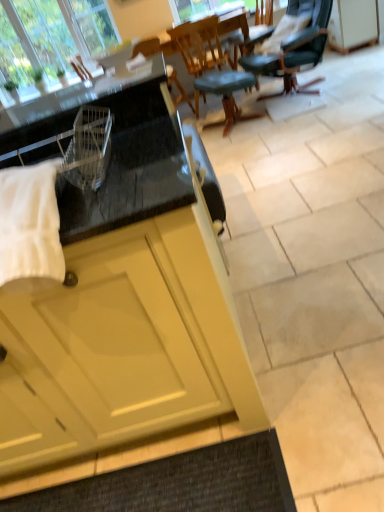
Question: Is wooden chair at center, which appears as the second chair when viewed from the right, looking in the opposite direction of matte yellow cabinet at upper right, the second cabinetry ordered from the bottom?

Choices:
 (A) yes
 (B) no

Answer: (B)

Question: From a real-world perspective, does wooden chair at center, which appears as the second chair when viewed from the right, sit lower than matte yellow cabinet at upper right, the second cabinetry ordered from the bottom?

Choices:
 (A) yes
 (B) no

Answer: (B)

Question: From the image's perspective, is wooden chair at center, which appears as the first chair when viewed from the left, below matte yellow cabinet at upper right, the second cabinetry ordered from the bottom?

Choices:
 (A) yes
 (B) no

Answer: (A)

Question: Is wooden chair at center, which appears as the second chair when viewed from the right, closer to the viewer compared to matte yellow cabinet at upper right, the second cabinetry ordered from the bottom?

Choices:
 (A) no
 (B) yes

Answer: (B)

Question: Can you confirm if wooden chair at center, which appears as the first chair when viewed from the left, is thinner than matte yellow cabinet at upper right, arranged as the second cabinetry when viewed from the left?

Choices:
 (A) yes
 (B) no

Answer: (B)

Question: In terms of size, does wooden chair at center, which appears as the first chair when viewed from the left, appear bigger or smaller than green leather office chair at upper right, the second chair when ordered from left to right?

Choices:
 (A) small
 (B) big

Answer: (A)

Question: From the image's perspective, is wooden chair at center, which appears as the second chair when viewed from the right, above or below green leather office chair at upper right, the second chair when ordered from left to right?

Choices:
 (A) below
 (B) above

Answer: (A)

Question: From a real-world perspective, relative to green leather office chair at upper right, the second chair when ordered from left to right, is wooden chair at center, which appears as the first chair when viewed from the left, vertically above or below?

Choices:
 (A) below
 (B) above

Answer: (A)

Question: Do you think wooden chair at center, which appears as the second chair when viewed from the right, is within green leather office chair at upper right, positioned as the first chair in right-to-left order, or outside of it?

Choices:
 (A) outside
 (B) inside

Answer: (A)

Question: Considering the positions of point (314, 33) and point (105, 256), is point (314, 33) closer or farther from the camera than point (105, 256)?

Choices:
 (A) closer
 (B) farther

Answer: (B)

Question: In the image, is green leather office chair at upper right, positioned as the first chair in right-to-left order, positioned in front of or behind matte yellow cabinet at lower left, the first cabinetry when ordered from left to right?

Choices:
 (A) behind
 (B) front

Answer: (A)

Question: Considering the positions of green leather office chair at upper right, the second chair when ordered from left to right, and matte yellow cabinet at lower left, marked as the second cabinetry in a right-to-left arrangement, in the image, is green leather office chair at upper right, the second chair when ordered from left to right, wider or thinner than matte yellow cabinet at lower left, marked as the second cabinetry in a right-to-left arrangement,?

Choices:
 (A) wide
 (B) thin

Answer: (B)

Question: Visually, is green leather office chair at upper right, the second chair when ordered from left to right, positioned to the left or to the right of matte yellow cabinet at lower left, the first cabinetry when ordered from left to right?

Choices:
 (A) left
 (B) right

Answer: (B)

Question: From a real-world perspective, is teal leather stool at center positioned above or below green leather office chair at upper right, the second chair when ordered from left to right?

Choices:
 (A) above
 (B) below

Answer: (B)

Question: Is point (256, 114) positioned closer to the camera than point (258, 57)?

Choices:
 (A) farther
 (B) closer

Answer: (B)